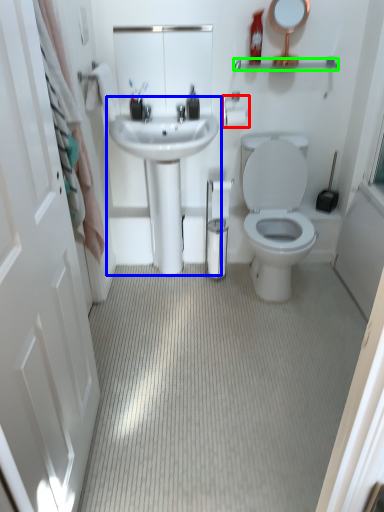
Question: Estimate the real-world distances between objects in this image. Which object is closer to towel bar (highlighted by a red box), sink (highlighted by a blue box) or balustrade (highlighted by a green box)?

Choices:
 (A) sink
 (B) balustrade

Answer: (B)